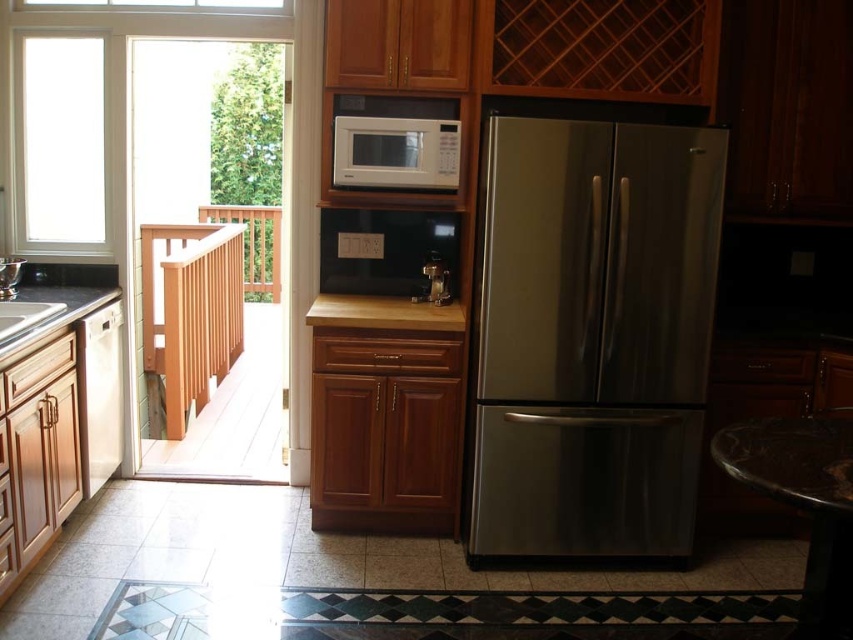
Question: Which object is closer to the camera taking this photo?

Choices:
 (A) white matte microwave at center
 (B) wooden stool at lower right
 (C) stainless steel refrigerator at center

Answer: (B)

Question: Considering the relative positions of white matte microwave at center and satin nickel sink at lower left in the image provided, where is white matte microwave at center located with respect to satin nickel sink at lower left?

Choices:
 (A) below
 (B) above

Answer: (B)

Question: Is brown wood counter at center wider than black granite countertop at lower left?

Choices:
 (A) yes
 (B) no

Answer: (A)

Question: Which of the following is the closest to the observer?

Choices:
 (A) (505, 312)
 (B) (22, 312)

Answer: (A)

Question: Which point appears farthest from the camera in this image?

Choices:
 (A) (759, 477)
 (B) (401, 144)

Answer: (B)

Question: Can you confirm if stainless steel refrigerator at center is positioned to the left of white glass window at upper left?

Choices:
 (A) yes
 (B) no

Answer: (B)